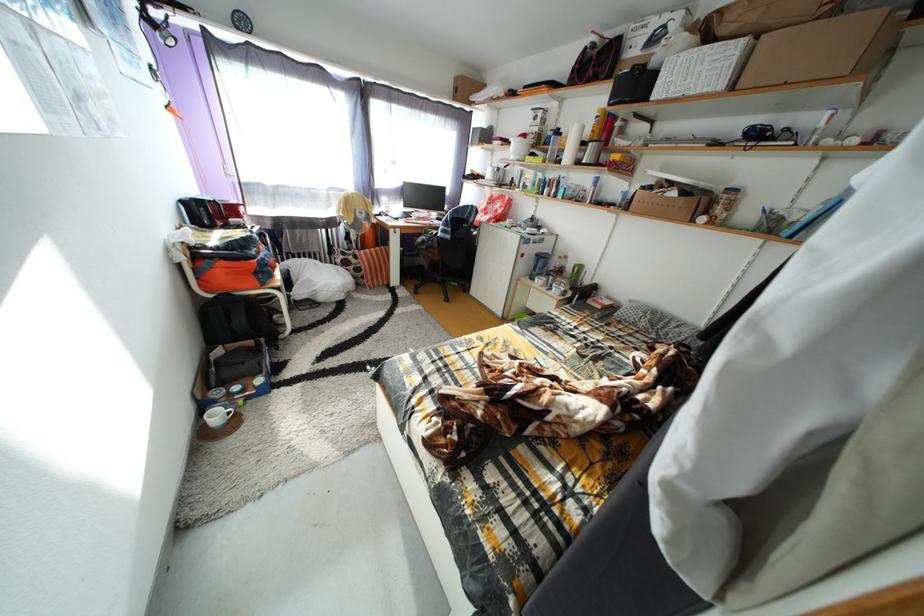
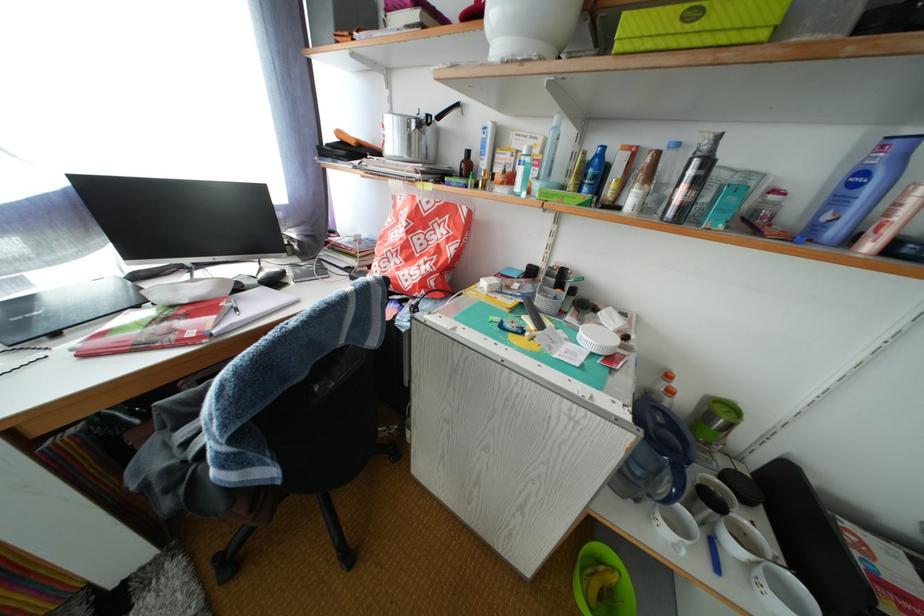
Question: What movement of the cameraman would produce the second image?

Choices:
 (A) Left
 (B) Right
 (C) Forward
 (D) Backward

Answer: (C)